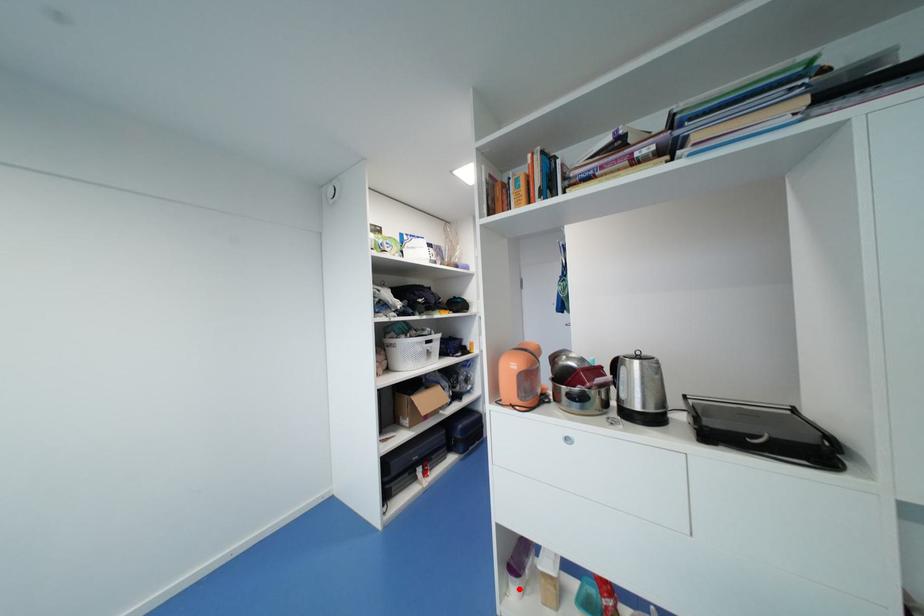
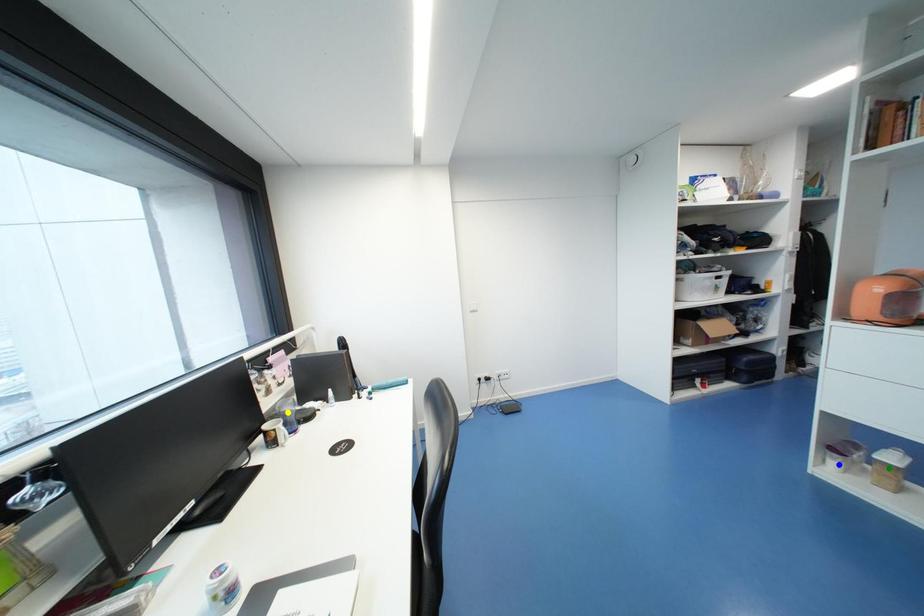
Question: I am providing you with two images of the same scene from different viewpoints. A red point is marked on the first image. You are given multiple points on the second image. Can you choose the point in image 2 that corresponds to the point in image 1?

Choices:
 (A) yellow point
 (B) blue point
 (C) green point

Answer: (B)